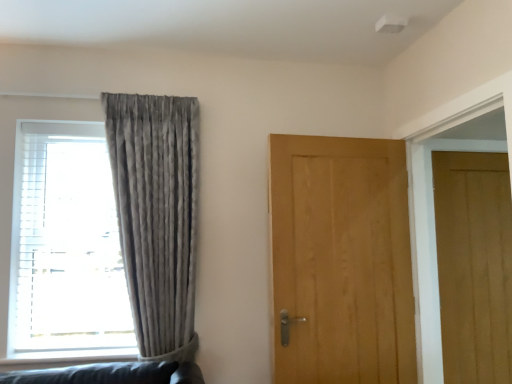
Question: From a real-world perspective, is light brown wood door at center, placed as the 1th door when sorted from left to right, over satin grey curtain at left?

Choices:
 (A) no
 (B) yes

Answer: (A)

Question: Can you confirm if light brown wood door at center, which is the second door from right to left, is shorter than satin grey curtain at left?

Choices:
 (A) no
 (B) yes

Answer: (B)

Question: From the image's perspective, does light brown wood door at center, which is the second door from right to left, appear lower than satin grey curtain at left?

Choices:
 (A) no
 (B) yes

Answer: (B)

Question: Can we say light brown wood door at center, positioned as the 1th door in front-to-back order, lies outside satin grey curtain at left?

Choices:
 (A) no
 (B) yes

Answer: (B)

Question: Is light brown wood door at center, placed as the 1th door when sorted from left to right, thinner than satin grey curtain at left?

Choices:
 (A) yes
 (B) no

Answer: (A)

Question: Looking at their shapes, would you say light brown wood door at right, marked as the 1th door in a right-to-left arrangement, is wider or thinner than matte gray curtain at left?

Choices:
 (A) wide
 (B) thin

Answer: (B)

Question: Relative to matte gray curtain at left, is light brown wood door at right, marked as the 1th door in a right-to-left arrangement, in front or behind?

Choices:
 (A) front
 (B) behind

Answer: (B)

Question: Considering the positions of point (450, 301) and point (99, 221), is point (450, 301) closer or farther from the camera than point (99, 221)?

Choices:
 (A) closer
 (B) farther

Answer: (B)

Question: From a real-world perspective, is light brown wood door at right, acting as the first door starting from the back, physically located above or below matte gray curtain at left?

Choices:
 (A) below
 (B) above

Answer: (A)

Question: From a real-world perspective, is matte gray curtain at left above or below light brown wood door at center, which is the second door from right to left?

Choices:
 (A) above
 (B) below

Answer: (A)

Question: From the image's perspective, is matte gray curtain at left positioned above or below light brown wood door at center, which is the second door from right to left?

Choices:
 (A) above
 (B) below

Answer: (A)

Question: Considering their positions, is matte gray curtain at left located in front of or behind light brown wood door at center, which is the second door from right to left?

Choices:
 (A) front
 (B) behind

Answer: (B)

Question: From their relative heights in the image, would you say matte gray curtain at left is taller or shorter than light brown wood door at center, acting as the 2th door starting from the back?

Choices:
 (A) short
 (B) tall

Answer: (B)

Question: Considering the positions of light brown wood door at center, which is the second door from right to left, and matte gray curtain at left in the image, is light brown wood door at center, which is the second door from right to left, bigger or smaller than matte gray curtain at left?

Choices:
 (A) big
 (B) small

Answer: (B)

Question: From a real-world perspective, is light brown wood door at center, placed as the 1th door when sorted from left to right, positioned above or below matte gray curtain at left?

Choices:
 (A) below
 (B) above

Answer: (A)